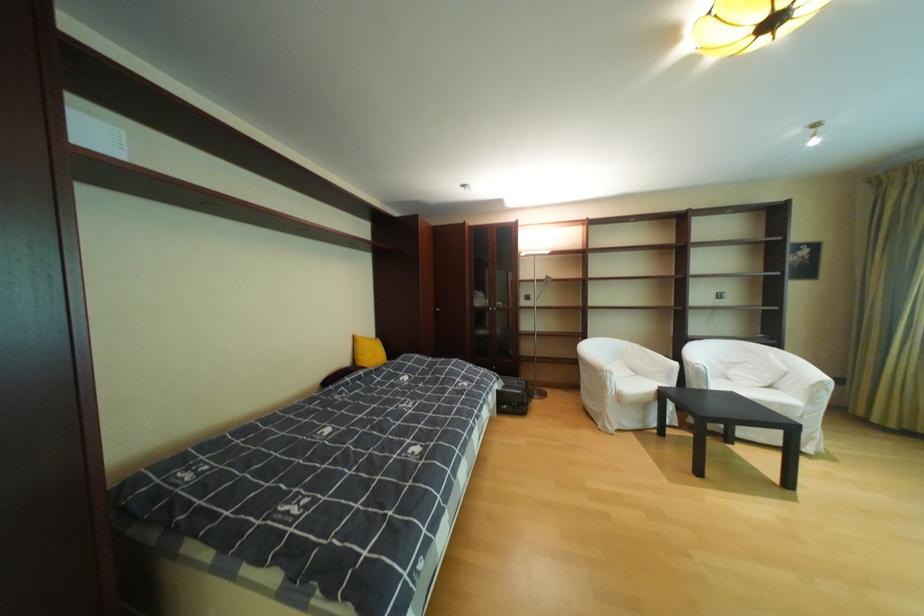
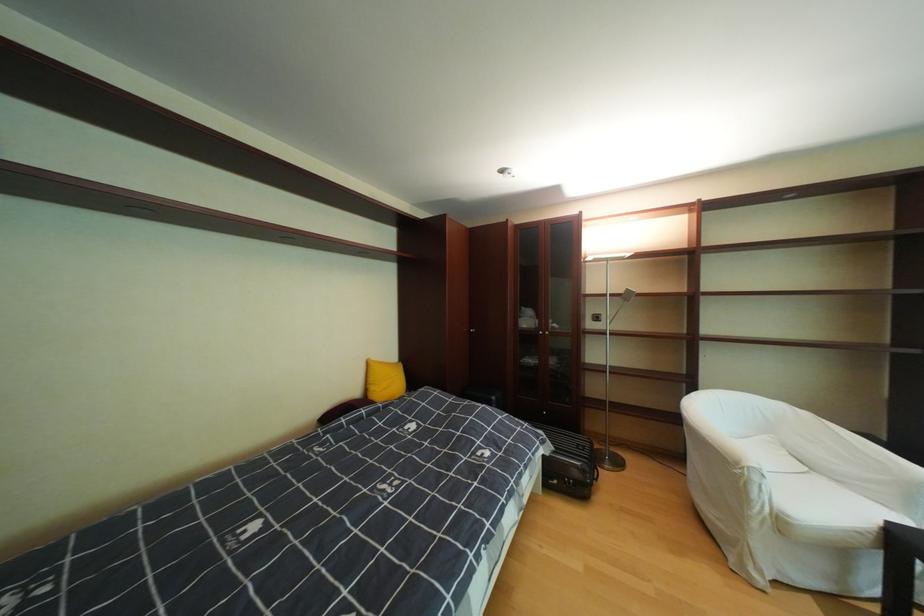
Find the pixel in the second image that matches (541,301) in the first image.

(612, 322)